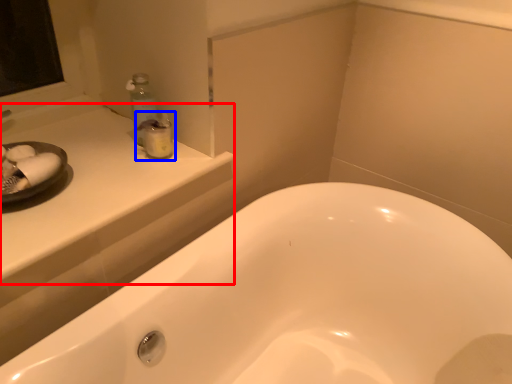
Question: Which object is further to the camera taking this photo, counter top (highlighted by a red box) or toiletry (highlighted by a blue box)?

Choices:
 (A) counter top
 (B) toiletry

Answer: (B)